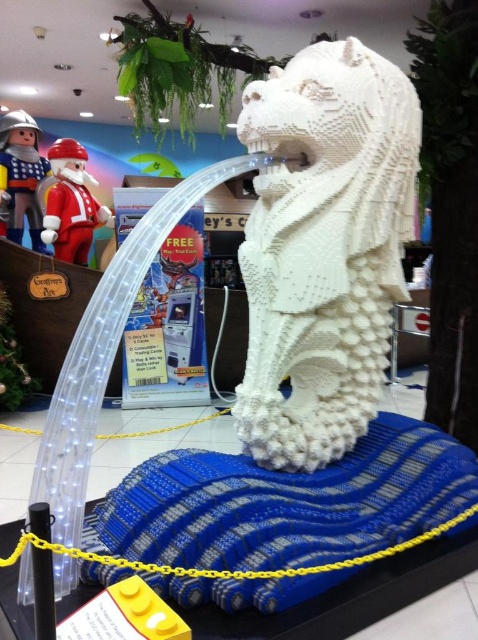
You are a visitor at the LEGO exhibit and want to take a photo of the mythical creature on the blue wave. There is a matte plastic santa at upper left in your view. Where should you position yourself to ensure the mythical creature is centered in your photo while avoiding the santa?

Result: Position yourself so that the center of your photo aligns with the mythical creature on the blue wave, ensuring the matte plastic santa at upper left is outside the frame. Since the santa is at coordinates approximately (71,204), move your camera slightly to the right or down to exclude it while keeping the creature centered.

You are a store employee who needs to place a new 18 inch wide decorative box between the matte plastic santa at upper left and the metallic silver toy soldier at upper left. Can you fit the box between them without moving either object?

The matte plastic santa at upper left and metallic silver toy soldier at upper left are 21.71 inches apart. Since the decorative box is 18 inches wide, there is enough space between them to fit the box without moving either object.

You are a visitor at the LEGO exhibit and want to take a photo of the mythical creature sculpture. You notice two points marked on the sculpture. The first point is at coordinate point (358,385) and the second is at point (56,150). Which point should you focus on to ensure it appears larger in your photo?

Point (358,385) is closer to the camera than point (56,150), so focusing on point (358,385) will make it appear larger in your photo.